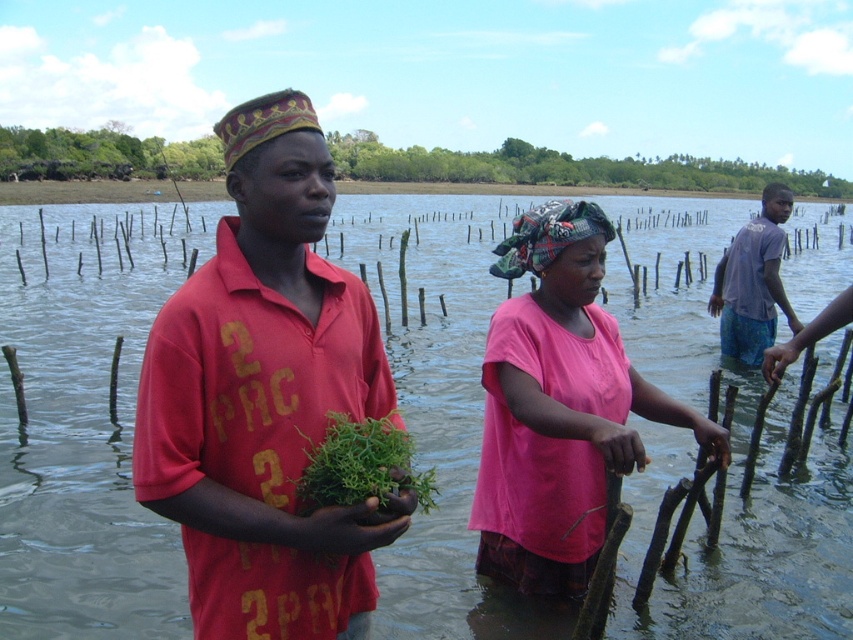
Is matte red shirt at center further to camera compared to pink fabric headscarf at center?

No, it is in front of pink fabric headscarf at center.

Can you confirm if matte red shirt at center is wider than pink fabric headscarf at center?

No.

Is point (276, 241) positioned before point (518, 563)?

Yes, point (276, 241) is closer to viewer.

Locate an element on the screen. matte red shirt at center is located at coordinates (265, 397).

Does matte red shirt at center appear under light blue fabric shorts at right?

Correct, matte red shirt at center is located below light blue fabric shorts at right.

Does matte red shirt at center have a larger size compared to light blue fabric shorts at right?

Actually, matte red shirt at center might be smaller than light blue fabric shorts at right.

What do you see at coordinates (265, 397) in the screenshot?
I see `matte red shirt at center` at bounding box center [265, 397].

At what (x,y) coordinates should I click in order to perform the action: click on matte red shirt at center. Please return your answer as a coordinate pair (x, y). The width and height of the screenshot is (853, 640). Looking at the image, I should click on (265, 397).

Is clear water at center wider than pink fabric headscarf at center?

Indeed, clear water at center has a greater width compared to pink fabric headscarf at center.

Can you confirm if clear water at center is positioned below pink fabric headscarf at center?

Incorrect, clear water at center is not positioned below pink fabric headscarf at center.

Is point (173, 627) positioned after point (498, 502)?

Yes, it is behind point (498, 502).

Where is `clear water at center`? The width and height of the screenshot is (853, 640). clear water at center is located at coordinates (83, 428).